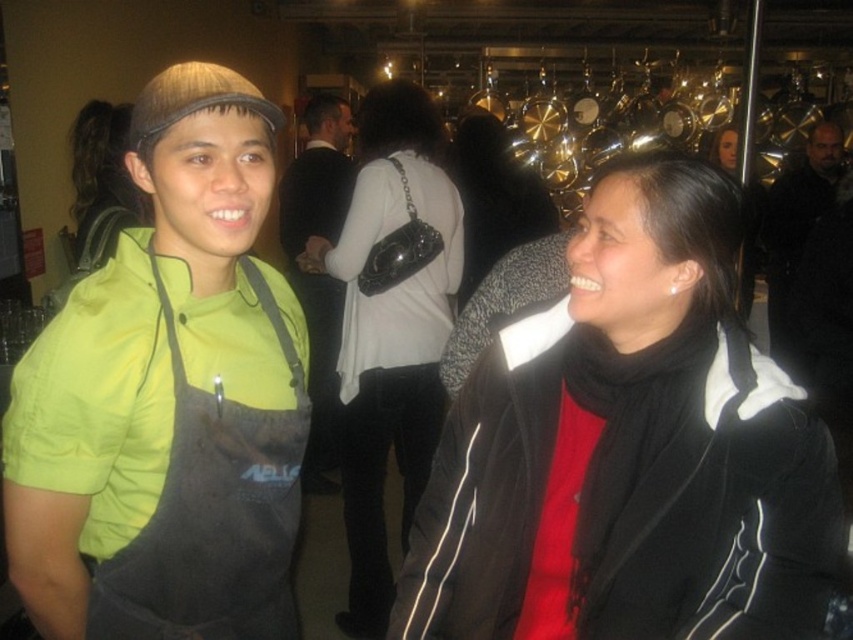
From the picture: You are standing in the center of the image and want to move towards the black matte jacket at center. Which direction should you go?

The black matte jacket at center is located at coordinates 0.703 on the x axis and 0.739 on the y axis, so you should move towards the lower right direction to reach it.

You are standing in the room and want to determine which of the two points, point [160,131] or point [316,314], is nearer to you. Based on the spatial arrangement in the scene, which point is closer?

Point [160,131] is closer to the viewer than point [316,314].

You are organizing a small event and need to place the matte black purse at center and the dark gray suit at center into a storage closet. The closet has a shelf with limited space. Which item should you place first to ensure both fit on the shelf?

The matte black purse at center is bigger than the dark gray suit at center, so you should place the matte black purse at center first to ensure both items fit on the shelf.